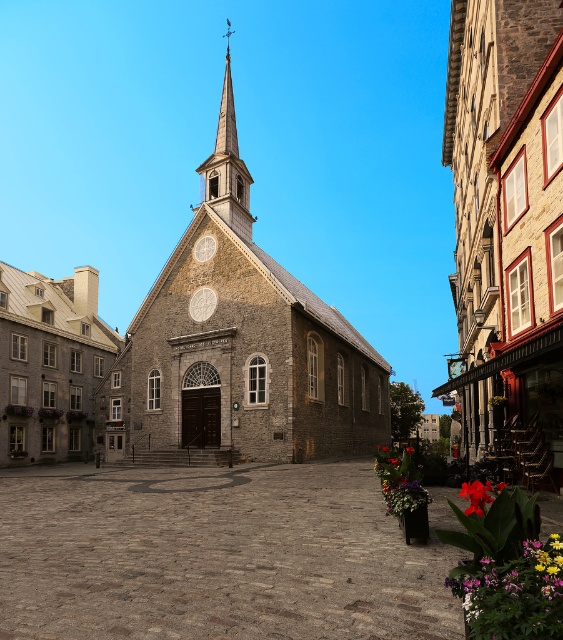
You are standing in the town square and see the vibrant floral bouquet at lower right and the vivid red petals at lower right. Which one is positioned more to the right side?

The vivid red petals at lower right are positioned more to the right side because the vibrant floral bouquet at lower right is to the left of them.

You are a photographer standing in the town square and want to capture both the vibrant floral bouquet at lower right and the vivid red petals at center in your shot. Which object will appear narrower in the photo?

The vibrant floral bouquet at lower right is thinner than the vivid red petals at center, so it will appear narrower in the photo.